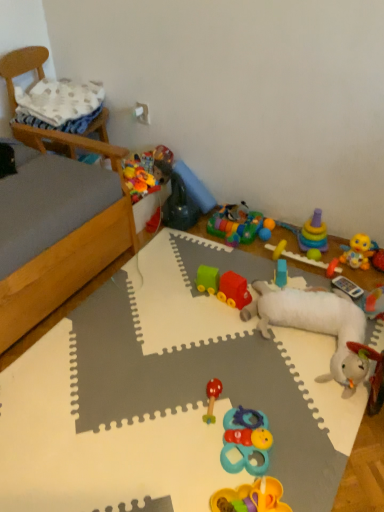
The width and height of the screenshot is (384, 512). Identify the location of free space in front of green rubber ball at upper right, arranged as the 7th toy when ordered from the bottom. tap(320, 275).